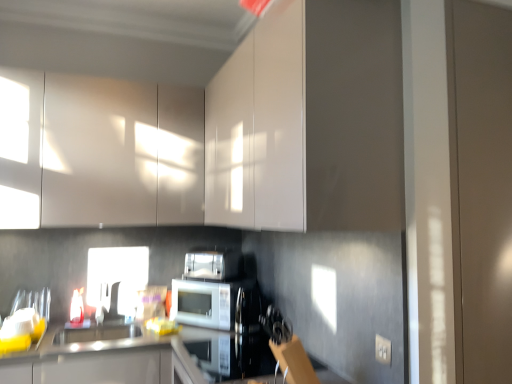
The height and width of the screenshot is (384, 512). What do you see at coordinates (96, 332) in the screenshot?
I see `white glossy sink at lower center` at bounding box center [96, 332].

The image size is (512, 384). In order to click on glossy white cabinet at upper center, placed as the second cabinetry when sorted from left to right in this screenshot , I will do `click(222, 134)`.

What do you see at coordinates (99, 152) in the screenshot? The width and height of the screenshot is (512, 384). I see `glossy white cabinets at upper left, the 1th cabinetry from the left` at bounding box center [99, 152].

Describe the element at coordinates (382, 350) in the screenshot. I see `white plastic electric outlet at lower right` at that location.

I want to click on translucent glass bottle at lower left, so click(x=77, y=307).

Is glossy white cabinets at upper left, which is the 2th cabinetry in right-to-left order, positioned with its back to glossy white cabinet at upper center, placed as the second cabinetry when sorted from left to right?

That's not correct — glossy white cabinets at upper left, which is the 2th cabinetry in right-to-left order, is not looking away from glossy white cabinet at upper center, placed as the second cabinetry when sorted from left to right.

Identify the location of cabinetry behind the glossy white cabinet at upper center, placed as the second cabinetry when sorted from left to right. This screenshot has width=512, height=384. (99, 152).

From the image's perspective, which one is positioned higher, glossy white cabinets at upper left, which is the 2th cabinetry in right-to-left order, or glossy white cabinet at upper center, placed as the second cabinetry when sorted from left to right?

glossy white cabinet at upper center, placed as the second cabinetry when sorted from left to right, is shown above in the image.

Do you think glossy white cabinets at upper left, which is the 2th cabinetry in right-to-left order, is within glossy white cabinet at upper center, which is counted as the 1th cabinetry, starting from the right, or outside of it?

glossy white cabinets at upper left, which is the 2th cabinetry in right-to-left order, cannot be found inside glossy white cabinet at upper center, which is counted as the 1th cabinetry, starting from the right.

Where is `cabinetry on the left of satin silver toaster at center`? The image size is (512, 384). cabinetry on the left of satin silver toaster at center is located at coordinates (99, 152).

Is glossy white cabinets at upper left, which is the 2th cabinetry in right-to-left order, aimed at satin silver toaster at center?

No, glossy white cabinets at upper left, which is the 2th cabinetry in right-to-left order, is not oriented towards satin silver toaster at center.

Who is smaller, glossy white cabinets at upper left, which is the 2th cabinetry in right-to-left order, or satin silver toaster at center?

Smaller between the two is satin silver toaster at center.

I want to click on oven located on the left of white plastic electric outlet at lower right, so click(228, 354).

Is satin black oven at center to the left or to the right of white plastic electric outlet at lower right in the image?

From the image, it's evident that satin black oven at center is to the left of white plastic electric outlet at lower right.

Who is smaller, satin black oven at center or white plastic electric outlet at lower right?

white plastic electric outlet at lower right.

Could you tell me if satin black oven at center is facing white plastic electric outlet at lower right?

No, satin black oven at center is not facing towards white plastic electric outlet at lower right.

How many degrees apart are the facing directions of satin silver microwave at center and white glossy sink at lower center?

48.9 degrees separate the facing orientations of satin silver microwave at center and white glossy sink at lower center.

From a real-world perspective, who is located lower, satin silver microwave at center or white glossy sink at lower center?

In real-world perspective, white glossy sink at lower center is lower.

Measure the distance between satin silver microwave at center and white glossy sink at lower center.

satin silver microwave at center and white glossy sink at lower center are 16.83 inches apart from each other.

Considering the relative positions of satin silver microwave at center and white glossy sink at lower center in the image provided, is satin silver microwave at center to the left or to the right of white glossy sink at lower center?

satin silver microwave at center is to the right of white glossy sink at lower center.

Between point (224, 260) and point (384, 360), which one is positioned behind?

The point (224, 260) is farther.

Looking at this image, between satin silver toaster at center and white plastic electric outlet at lower right, which one is positioned in front?

white plastic electric outlet at lower right is closer to the camera.

Is satin silver toaster at center at the left side of white plastic electric outlet at lower right?

Indeed, satin silver toaster at center is positioned on the left side of white plastic electric outlet at lower right.

From the image's perspective, is satin silver toaster at center on top of white plastic electric outlet at lower right?

Correct, satin silver toaster at center appears higher than white plastic electric outlet at lower right in the image.

Is satin silver toaster at center far from translucent glass bottle at lower left?

No, satin silver toaster at center is in close proximity to translucent glass bottle at lower left.

Is satin silver toaster at center bigger than translucent glass bottle at lower left?

Yes.

Can you tell me how much satin silver toaster at center and translucent glass bottle at lower left differ in facing direction?

satin silver toaster at center and translucent glass bottle at lower left are facing 28.6 degrees away from each other.

Between point (221, 266) and point (71, 315), which one is positioned behind?

The point (221, 266) is more distant.

From a real-world perspective, is satin silver toaster at center under white glossy sink at lower center?

No, from a real-world perspective, satin silver toaster at center is not below white glossy sink at lower center.

From the image's perspective, does satin silver toaster at center appear higher than white glossy sink at lower center?

Yes, from the image's perspective, satin silver toaster at center is above white glossy sink at lower center.

Is satin silver toaster at center positioned with its back to white glossy sink at lower center?

No, white glossy sink at lower center is not at the back of satin silver toaster at center.

Looking at this image, between satin silver toaster at center and white glossy sink at lower center, which one has larger width?

With larger width is white glossy sink at lower center.

This screenshot has width=512, height=384. I want to click on cabinetry that appears on the left of glossy white cabinet at upper center, which is counted as the 1th cabinetry, starting from the right, so pos(99,152).

At what (x,y) coordinates should I click in order to perform the action: click on appliance behind the glossy white cabinets at upper left, which is the 2th cabinetry in right-to-left order. Please return your answer as a coordinate pair (x, y). Looking at the image, I should click on (205, 265).

Estimate the real-world distances between objects in this image. Which object is closer to white plastic electric outlet at lower right, white glossy sink at lower center or satin silver toaster at center?

Based on the image, satin silver toaster at center appears to be nearer to white plastic electric outlet at lower right.

In the scene shown: When comparing their distances from glossy white cabinet at upper center, placed as the second cabinetry when sorted from left to right, does satin black oven at center or translucent glass bottle at lower left seem further?

Among the two, satin black oven at center is located further to glossy white cabinet at upper center, placed as the second cabinetry when sorted from left to right.

Looking at the image, which one is located closer to white plastic electric outlet at lower right, satin silver microwave at center or satin silver toaster at center?

satin silver microwave at center is positioned closer to the anchor white plastic electric outlet at lower right.

Looking at this image, from the image, which object appears to be farther from satin silver microwave at center, satin silver toaster at center or translucent glass bottle at lower left?

translucent glass bottle at lower left.

From the image, which object appears to be nearer to translucent glass bottle at lower left, white glossy sink at lower center or satin black oven at center?

white glossy sink at lower center is closer to translucent glass bottle at lower left.

Looking at this image, which object lies nearer to the anchor point satin silver toaster at center, satin silver microwave at center or glossy white cabinets at upper left, the 1th cabinetry from the left?

Based on the image, satin silver microwave at center appears to be nearer to satin silver toaster at center.

Looking at the image, which one is located closer to glossy white cabinet at upper center, which is counted as the 1th cabinetry, starting from the right, white plastic electric outlet at lower right or satin silver toaster at center?

satin silver toaster at center is closer to glossy white cabinet at upper center, which is counted as the 1th cabinetry, starting from the right.

Which object lies nearer to the anchor point white glossy sink at lower center, satin silver toaster at center or satin black oven at center?

satin black oven at center.

Find the location of a particular element. This screenshot has height=384, width=512. cabinetry between glossy white cabinets at upper left, the 1th cabinetry from the left, and white plastic electric outlet at lower right is located at coordinates (222, 134).

This screenshot has width=512, height=384. Identify the location of appliance between translucent glass bottle at lower left and satin black oven at center. (205, 265).

Where is `sink between glossy white cabinet at upper center, which is counted as the 1th cabinetry, starting from the right, and translucent glass bottle at lower left from front to back`? Image resolution: width=512 pixels, height=384 pixels. sink between glossy white cabinet at upper center, which is counted as the 1th cabinetry, starting from the right, and translucent glass bottle at lower left from front to back is located at coordinates (96, 332).

Where is `appliance situated between white glossy sink at lower center and satin black oven at center from left to right`? The height and width of the screenshot is (384, 512). appliance situated between white glossy sink at lower center and satin black oven at center from left to right is located at coordinates (205, 265).